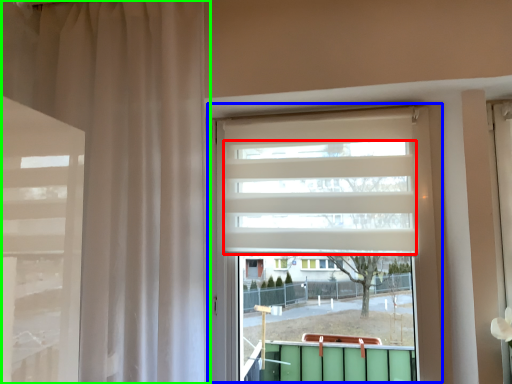
Question: Which object is the farthest from blind (highlighted by a red box)? Choose among these: window (highlighted by a blue box) or curtain (highlighted by a green box).

Choices:
 (A) window
 (B) curtain

Answer: (B)